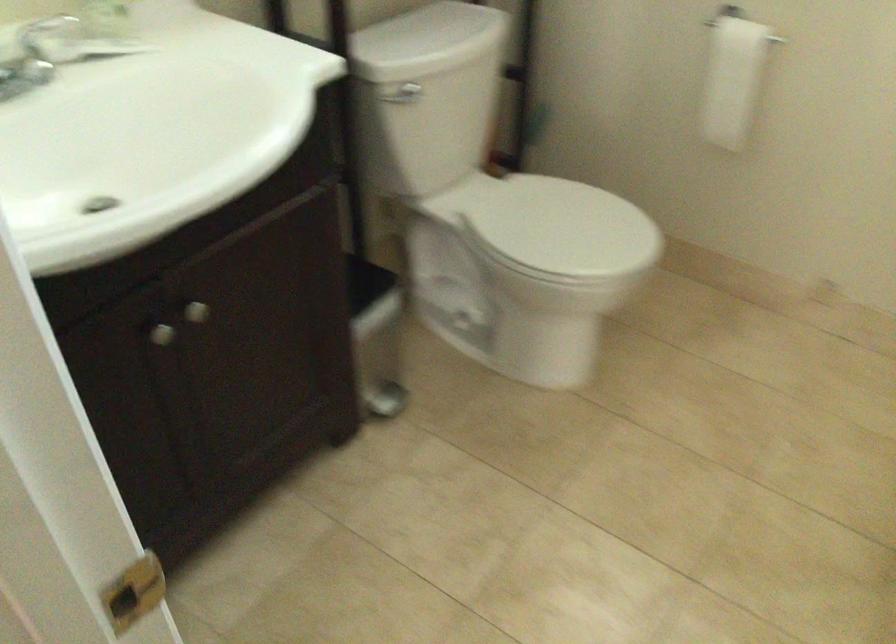
What do you see at coordinates (23, 77) in the screenshot? I see `the faucet handle` at bounding box center [23, 77].